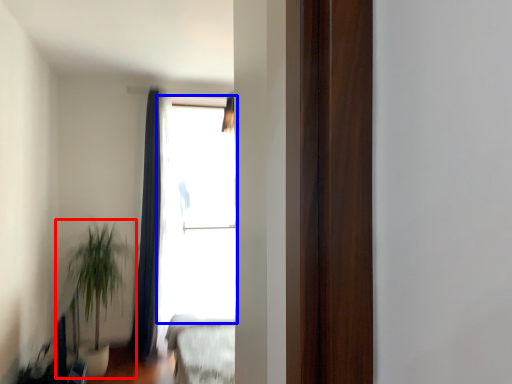
Question: Which object appears farthest to the camera in this image, houseplant (highlighted by a red box) or window (highlighted by a blue box)?

Choices:
 (A) houseplant
 (B) window

Answer: (B)